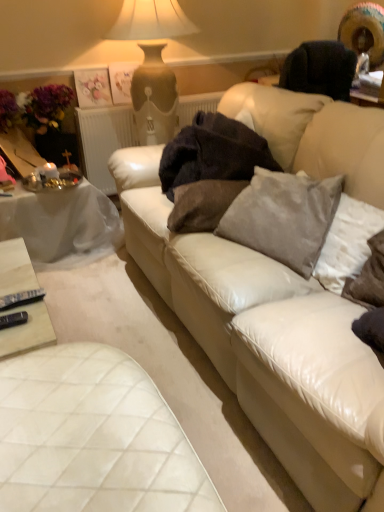
What do you see at coordinates (62, 225) in the screenshot?
I see `white cloth-covered table at left, the second table viewed from the front` at bounding box center [62, 225].

Describe the element at coordinates (213, 153) in the screenshot. I see `dark woolen blanket at center` at that location.

Locate an element on the screen. This screenshot has width=384, height=512. white quilted leather table at lower left, acting as the 1th table starting from the front is located at coordinates (93, 437).

Find the location of a particular element. This screenshot has width=384, height=512. white leather couch at center is located at coordinates (267, 343).

What do you see at coordinates (202, 204) in the screenshot? I see `velvet gray pillow at center, placed as the 3th pillow when sorted from right to left` at bounding box center [202, 204].

This screenshot has width=384, height=512. Identify the location of white cloth-covered table at left, placed as the 1th table when sorted from back to front. (62, 225).

How different are the orientations of white leather couch at center and dark woolen blanket at center in degrees?

They differ by 46.4 degrees in their facing directions.

Is white leather couch at center inside the boundaries of dark woolen blanket at center, or outside?

white leather couch at center lies outside dark woolen blanket at center.

Considering the sizes of objects white leather couch at center and dark woolen blanket at center in the image provided, who is shorter, white leather couch at center or dark woolen blanket at center?

Standing shorter between the two is dark woolen blanket at center.

Is white leather couch at center oriented towards dark woolen blanket at center?

Yes, white leather couch at center faces towards dark woolen blanket at center.

Does gray velvet pillow at center, the second pillow positioned from the right, appear on the left side of velvet gray pillow at center, placed as the 3th pillow when sorted from right to left?

Incorrect, gray velvet pillow at center, the second pillow positioned from the right, is not on the left side of velvet gray pillow at center, placed as the 3th pillow when sorted from right to left.

From a real-world perspective, does gray velvet pillow at center, the second pillow viewed from the left, stand above velvet gray pillow at center, placed as the 1th pillow when sorted from left to right?

Yes, from a real-world perspective, gray velvet pillow at center, the second pillow viewed from the left, is over velvet gray pillow at center, placed as the 1th pillow when sorted from left to right

Do you think gray velvet pillow at center, the second pillow positioned from the right, is within velvet gray pillow at center, placed as the 3th pillow when sorted from right to left, or outside of it?

gray velvet pillow at center, the second pillow positioned from the right, is spatially situated outside velvet gray pillow at center, placed as the 3th pillow when sorted from right to left.

Is gray velvet pillow at center, the second pillow viewed from the left, beside velvet gray pillow at center, placed as the 1th pillow when sorted from left to right?

gray velvet pillow at center, the second pillow viewed from the left, is not next to velvet gray pillow at center, placed as the 1th pillow when sorted from left to right, and they're not touching.

From a real-world perspective, is white quilted leather table at lower left, placed as the 1th table when sorted from bottom to top, physically below gray velvet pillow at center, the second pillow positioned from the right?

Yes, from a real-world perspective, white quilted leather table at lower left, placed as the 1th table when sorted from bottom to top, is under gray velvet pillow at center, the second pillow positioned from the right.

From the image's perspective, is white quilted leather table at lower left, acting as the 1th table starting from the front, above or below gray velvet pillow at center, the second pillow positioned from the right?

From the image's perspective, white quilted leather table at lower left, acting as the 1th table starting from the front, appears below gray velvet pillow at center, the second pillow positioned from the right.

Considering the relative positions of white quilted leather table at lower left, the second table from the top, and gray velvet pillow at center, the second pillow viewed from the left, in the image provided, is white quilted leather table at lower left, the second table from the top, to the right of gray velvet pillow at center, the second pillow viewed from the left, from the viewer's perspective?

No, white quilted leather table at lower left, the second table from the top, is not to the right of gray velvet pillow at center, the second pillow viewed from the left.

Is the surface of white quilted leather table at lower left, acting as the 1th table starting from the front, in direct contact with gray velvet pillow at center, the second pillow viewed from the left?

There is a gap between white quilted leather table at lower left, acting as the 1th table starting from the front, and gray velvet pillow at center, the second pillow viewed from the left.

From a real-world perspective, which is physically below, white quilted leather table at lower left, the second table from the top, or velvet gray pillow at center, placed as the 3th pillow when sorted from right to left?

From a 3D spatial view, white quilted leather table at lower left, the second table from the top, is below.

Considering the points (24, 372) and (171, 219), which point is behind, point (24, 372) or point (171, 219)?

The point (171, 219) is farther from the camera.

From the picture: Can we say white quilted leather table at lower left, placed as the 1th table when sorted from bottom to top, lies outside velvet gray pillow at center, placed as the 1th pillow when sorted from left to right?

white quilted leather table at lower left, placed as the 1th table when sorted from bottom to top, lies outside velvet gray pillow at center, placed as the 1th pillow when sorted from left to right,'s area.

Are white quilted leather table at lower left, the second table from the top, and velvet gray pillow at center, placed as the 3th pillow when sorted from right to left, beside each other?

There is a gap between white quilted leather table at lower left, the second table from the top, and velvet gray pillow at center, placed as the 3th pillow when sorted from right to left.

Is white textured radiator at upper center oriented away from dark woolen blanket at center?

No, white textured radiator at upper center is not facing the opposite direction of dark woolen blanket at center.

Considering the points (79, 130) and (273, 161), which point is in front, point (79, 130) or point (273, 161)?

The point (273, 161) is more forward.

Based on the photo, can you confirm if white textured radiator at upper center is positioned to the left of dark woolen blanket at center?

Correct, you'll find white textured radiator at upper center to the left of dark woolen blanket at center.

Relative to dark woolen blanket at center, is white textured radiator at upper center in front or behind?

Visually, white textured radiator at upper center is located behind dark woolen blanket at center.

Which is closer to the camera, (53,200) or (170,180)?

Point (53,200) is farther from the camera than point (170,180).

Can you confirm if white cloth-covered table at left, positioned as the second table in bottom-to-top order, is thinner than dark woolen blanket at center?

No, white cloth-covered table at left, positioned as the second table in bottom-to-top order, is not thinner than dark woolen blanket at center.

Is white cloth-covered table at left, placed as the 1th table when sorted from back to front, in front of or behind dark woolen blanket at center in the image?

white cloth-covered table at left, placed as the 1th table when sorted from back to front, is positioned farther from the viewer than dark woolen blanket at center.

Based on the photo, can you confirm if white cloth-covered table at left, acting as the first table starting from the top, is bigger than dark woolen blanket at center?

Indeed, white cloth-covered table at left, acting as the first table starting from the top, has a larger size compared to dark woolen blanket at center.

Would you consider dark woolen blanket at center to be distant from white leather couch at center?

They are positioned close to each other.

Considering the relative sizes of dark woolen blanket at center and white leather couch at center in the image provided, is dark woolen blanket at center wider than white leather couch at center?

Incorrect, the width of dark woolen blanket at center does not surpass that of white leather couch at center.

From a real-world perspective, between dark woolen blanket at center and white leather couch at center, who is vertically lower?

From a 3D spatial view, white leather couch at center is below.

From the picture: Is white leather couch at center surrounded by dark woolen blanket at center?

No, white leather couch at center is not surrounded by dark woolen blanket at center.

This screenshot has width=384, height=512. I want to click on blanket that appears above the white leather couch at center (from the image's perspective), so click(x=213, y=153).

Where is `pillow above the velvet gray pillow at center, placed as the 3th pillow when sorted from right to left (from a real-world perspective)`? pillow above the velvet gray pillow at center, placed as the 3th pillow when sorted from right to left (from a real-world perspective) is located at coordinates (283, 217).

Looking at the image, which one is located closer to white leather couch at center, gray velvet pillow at center, the second pillow viewed from the left, or white cloth-covered table at left, positioned as the second table in bottom-to-top order?

gray velvet pillow at center, the second pillow viewed from the left, lies closer to white leather couch at center than the other object.

Looking at the image, which one is located closer to gray velvet pillow at center, the second pillow viewed from the left, white textured radiator at upper center or dark woolen blanket at center?

dark woolen blanket at center is positioned closer to the anchor gray velvet pillow at center, the second pillow viewed from the left.

From the image, which object appears to be nearer to velvet gray pillow at center, placed as the 1th pillow when sorted from left to right, white textured radiator at upper center or gray velvet pillow at center, the second pillow viewed from the left?

gray velvet pillow at center, the second pillow viewed from the left.

From the image, which object appears to be nearer to white textured radiator at upper center, white cloth-covered table at left, positioned as the second table in bottom-to-top order, or dark woolen blanket at center?

white cloth-covered table at left, positioned as the second table in bottom-to-top order, is positioned closer to the anchor white textured radiator at upper center.

When comparing their distances from velvet gray pillow at center, placed as the 1th pillow when sorted from left to right, does dark woolen blanket at center or gray velvety pillow at right, which is counted as the 1th pillow, starting from the right, seem further?

gray velvety pillow at right, which is counted as the 1th pillow, starting from the right, is positioned further to the anchor velvet gray pillow at center, placed as the 1th pillow when sorted from left to right.

Based on their spatial positions, is white quilted leather table at lower left, acting as the 1th table starting from the front, or gray velvety pillow at right, the third pillow positioned from the left, closer to velvet gray pillow at center, placed as the 3th pillow when sorted from right to left?

Among the two, gray velvety pillow at right, the third pillow positioned from the left, is located nearer to velvet gray pillow at center, placed as the 3th pillow when sorted from right to left.

From the image, which object appears to be farther from white textured radiator at upper center, gray velvety pillow at right, the third pillow positioned from the left, or white leather couch at center?

gray velvety pillow at right, the third pillow positioned from the left, is positioned further to the anchor white textured radiator at upper center.

When comparing their distances from velvet gray pillow at center, placed as the 1th pillow when sorted from left to right, does white quilted leather table at lower left, placed as the 1th table when sorted from bottom to top, or white leather couch at center seem further?

white quilted leather table at lower left, placed as the 1th table when sorted from bottom to top, is positioned further to the anchor velvet gray pillow at center, placed as the 1th pillow when sorted from left to right.

What are the coordinates of `pillow positioned between gray velvet pillow at center, the second pillow viewed from the left, and white textured radiator at upper center from near to far` in the screenshot? It's located at (202, 204).

Find the location of a particular element. blanket between white quilted leather table at lower left, acting as the 1th table starting from the front, and white cloth-covered table at left, the second table viewed from the front, along the z-axis is located at coordinates (213, 153).

This screenshot has height=512, width=384. I want to click on studio couch between gray velvet pillow at center, the second pillow positioned from the right, and white quilted leather table at lower left, placed as the 1th table when sorted from bottom to top, vertically, so click(x=267, y=343).

What are the coordinates of `pillow located between white cloth-covered table at left, placed as the 1th table when sorted from back to front, and gray velvet pillow at center, the second pillow viewed from the left, in the left-right direction` in the screenshot? It's located at (202, 204).